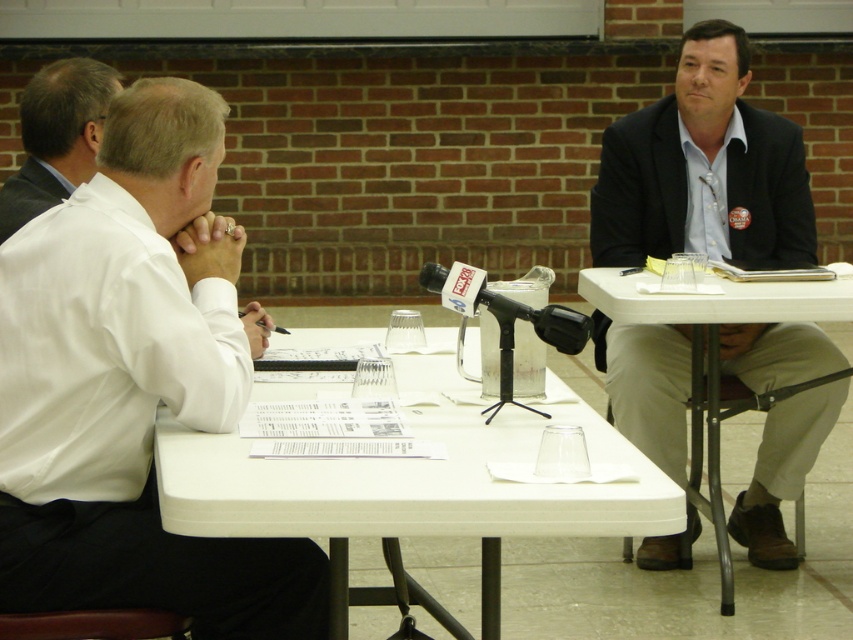
Based on the photo, you are a photographer standing at the back of the room. You want to take a photo that includes both the white plastic table at center and the white smooth shirt at left without moving any objects. Is the distance between them sufficient to fit both in the frame of your camera, which has a maximum coverage of 1.5 meters?

The distance between the white plastic table at center and the white smooth shirt at left is 1.29 meters, which is less than the camera frame maximum coverage of 1.5 meters. Therefore, the photographer can capture both objects in a single frame.

You are a photographer setting up for a group photo. You need to position a camera so that both the white plastic table at center and the white smooth shirt at left are in frame. Based on their positions, which object should you focus on first to ensure both are in the shot?

The white plastic table at center is located below the white smooth shirt at left, so you should focus on the white smooth shirt at left first to ensure both are in the frame.